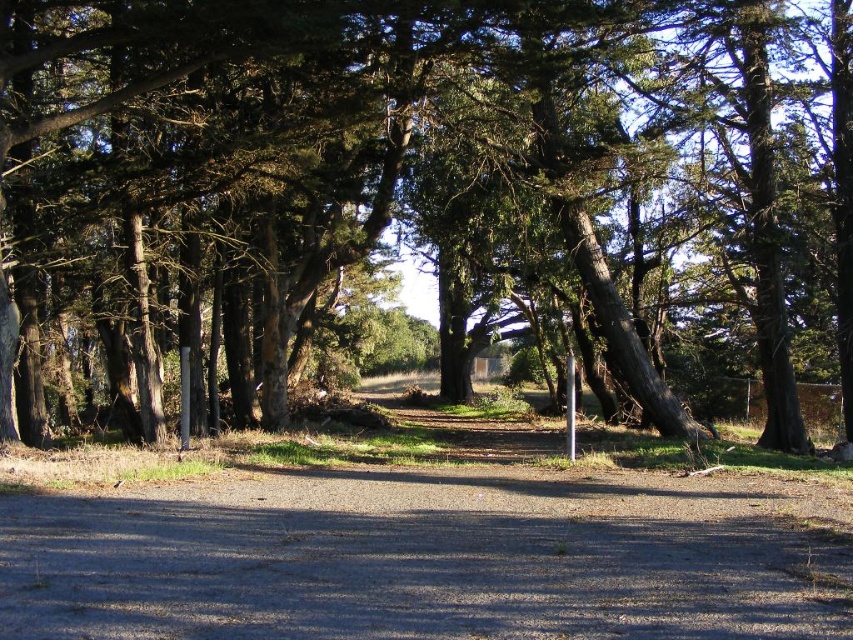
You are a hiker walking along the gray gravel dirt track at center in the forest. You notice a green textured tree at center blocking your path. Can you pass through between them without touching the tree?

The green textured tree at center is wider than the gray gravel dirt track at center, so passing through between them might be challenging as the tree is wider than the track.